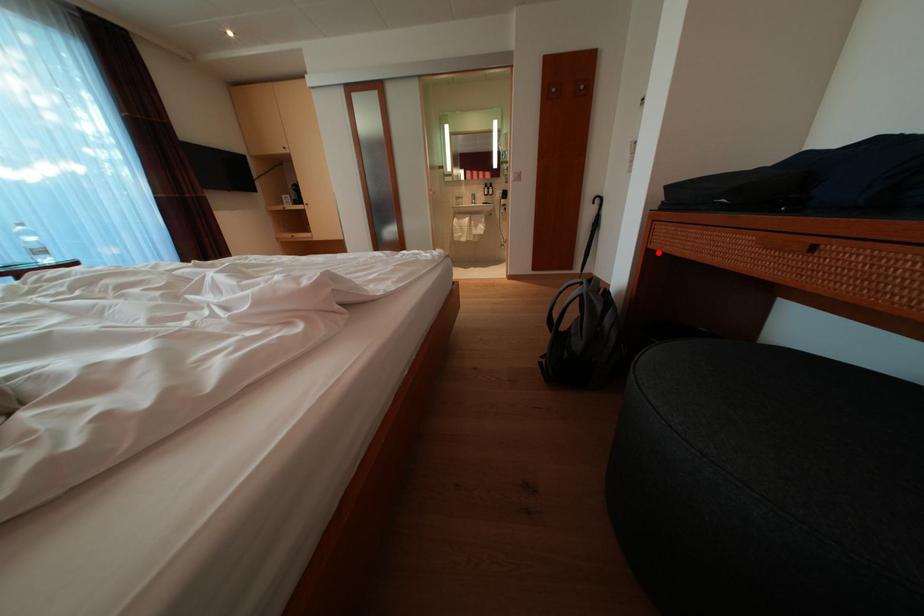
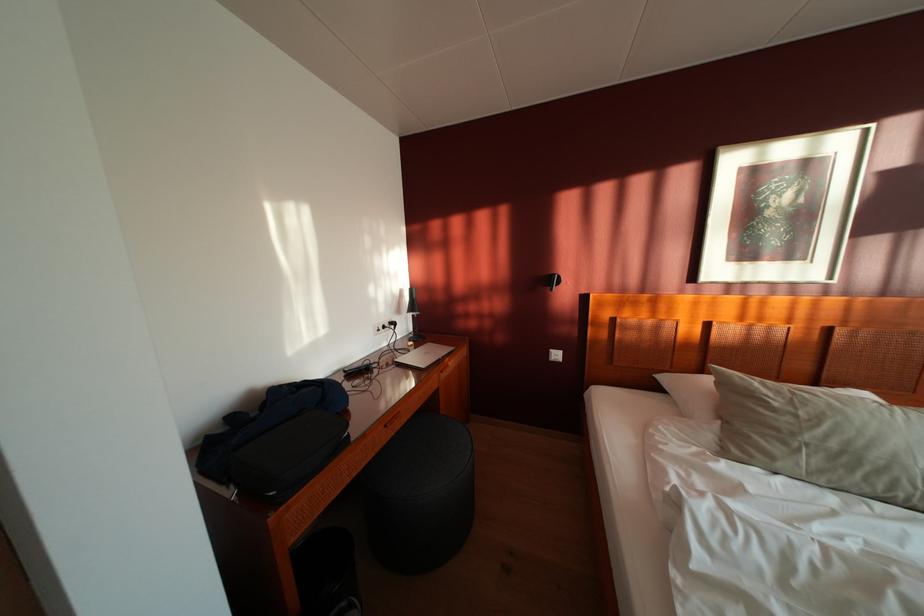
Question: A red point is marked in image1. In image2, is the corresponding 3D point closer to the camera or farther? Reply with the corresponding letter.

Choices:
 (A) The corresponding 3D point is closer.
 (B) The corresponding 3D point is farther.

Answer: (B)